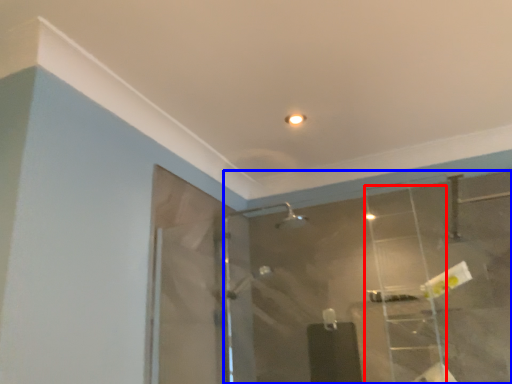
Question: Which point is further to the camera, ladder (highlighted by a red box) or mirror (highlighted by a blue box)?

Choices:
 (A) ladder
 (B) mirror

Answer: (A)